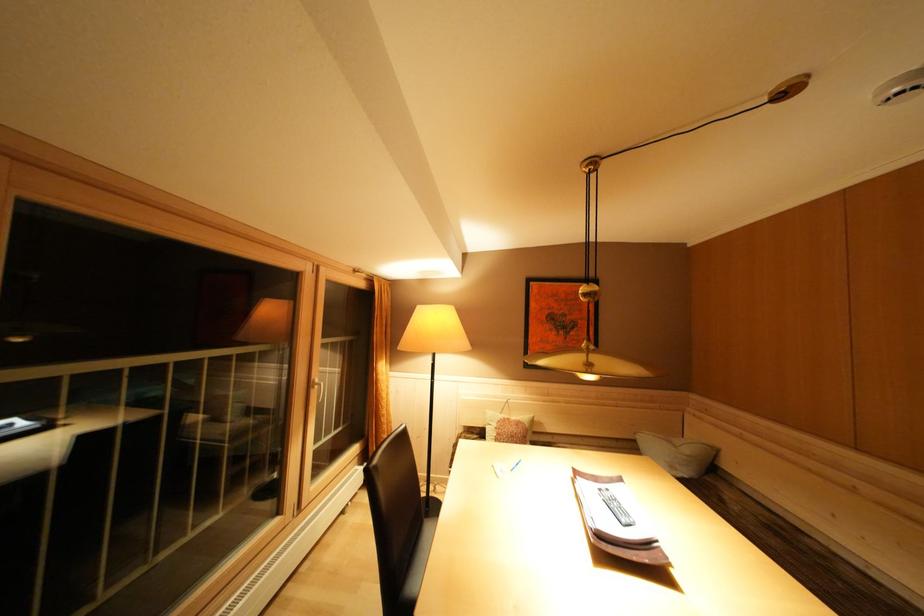
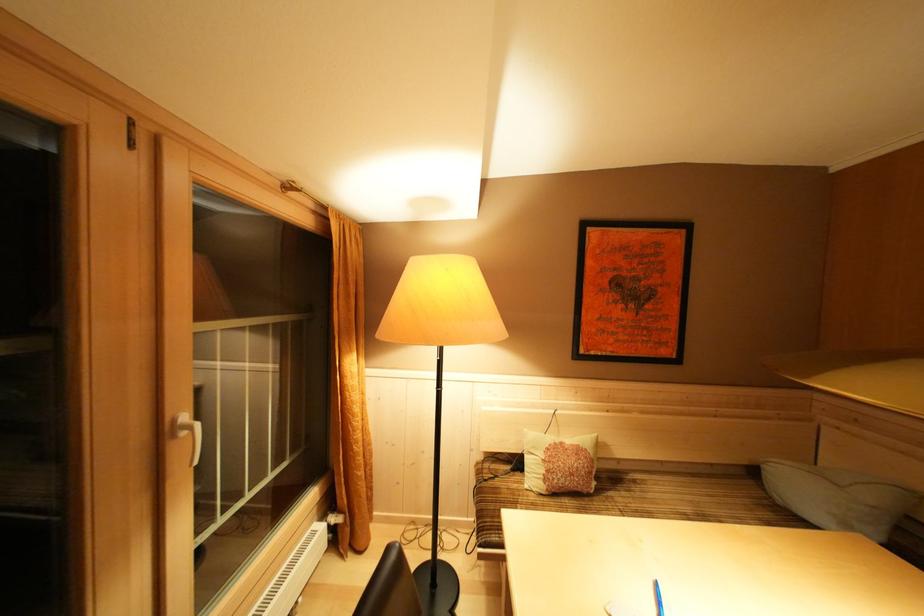
In the second image, find the point that corresponds to point 695,456 in the first image.

(879, 503)